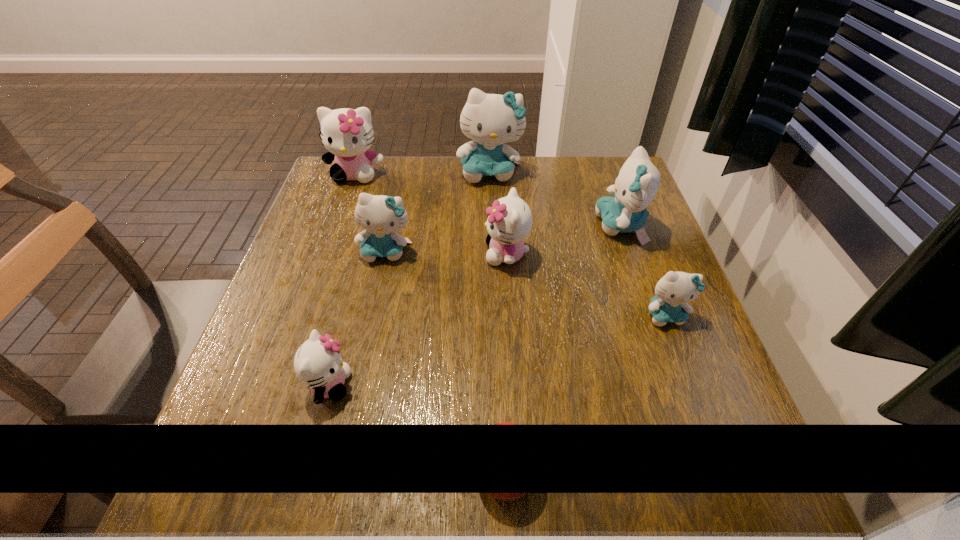
You are a GUI agent. You are given a task and a screenshot of the screen. Output one action in this format:
    pyautogui.click(x=<x>, y=<y>)
    Task: Click on the nearest blue kitten
    This screenshot has width=960, height=540.
    Given the screenshot: What is the action you would take?
    pyautogui.click(x=674, y=290)

The image size is (960, 540). What are the coordinates of `the shortest object` in the screenshot? It's located at (505, 423).

Locate an element on the screen. The image size is (960, 540). the nearest object is located at coordinates (505, 423).

The image size is (960, 540). What are the coordinates of `vacant space situated 0.050m on the face of the farthest blue kitten` in the screenshot? It's located at (491, 199).

Where is `vacant space situated 0.240m on the face of the second biggest blue kitten`? This screenshot has height=540, width=960. vacant space situated 0.240m on the face of the second biggest blue kitten is located at coordinates (497, 226).

Identify the location of vacant region located 0.190m on the face of the second biggest blue kitten. (517, 226).

You are a GUI agent. You are given a task and a screenshot of the screen. Output one action in this format:
    pyautogui.click(x=<x>, y=<y>)
    Task: Click on the vacant space located 0.260m on the face of the second biggest blue kitten
    The image size is (960, 540).
    Given the screenshot: What is the action you would take?
    tap(490, 226)

Identify the location of vacant space positioned 0.080m on the front-facing side of the farthest white kitten. The width and height of the screenshot is (960, 540). (345, 205).

Locate an element on the screen. The height and width of the screenshot is (540, 960). free spot located 0.160m on the front-facing side of the rightmost white kitten is located at coordinates (414, 254).

The image size is (960, 540). I want to click on vacant region located 0.400m on the front-facing side of the rightmost white kitten, so click(309, 254).